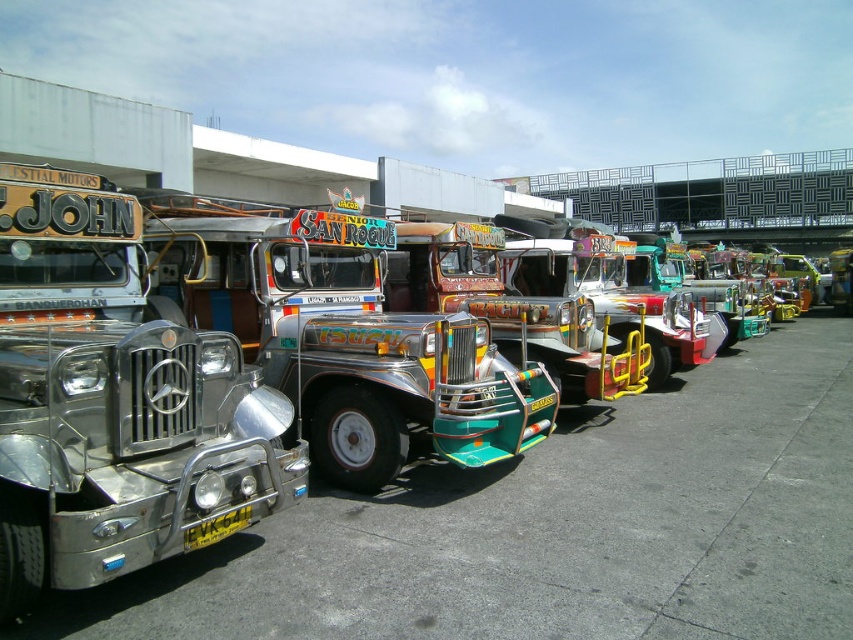
You are a pedestrian standing in front of the two vehicles, the shiny chrome trailer truck at center and the shiny metallic bus at center. Which vehicle is positioned to the left side from your perspective?

The shiny chrome trailer truck at center is positioned to the left of the shiny metallic bus at center, so the shiny chrome trailer truck at center is on the left side from your perspective.

You are a delivery person who needs to park your delivery van between the shiny metallic bus at left and the shiny silver trailer truck at left. Which vehicle should you park closer to if you want to maximize the space between your van and the other vehicles?

You should park closer to the shiny silver trailer truck at left because the shiny metallic bus at left is larger in size than the shiny silver trailer truck at left, so there will be more space between your van and the trailer truck.

You are standing at the entrance of the parking area and want to locate the shiny chrome trailer truck at center. According to the coordinates provided, where exactly is it positioned?

The shiny chrome trailer truck at center is positioned at coordinates point [343,337].